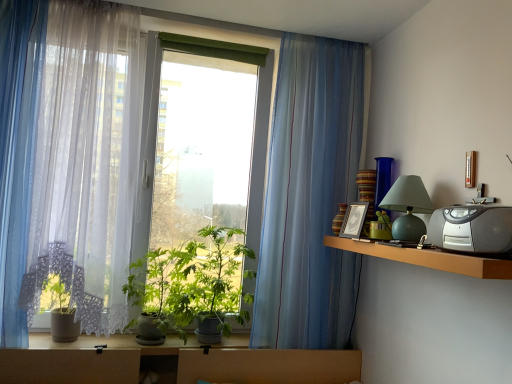
Question: From a real-world perspective, is translucent fabric curtain at left, which is the 3th curtain from right to left, above or below translucent blue curtain at center, arranged as the 3th curtain when viewed from the left?

Choices:
 (A) above
 (B) below

Answer: (A)

Question: Considering the positions of translucent fabric curtain at left, which is the 3th curtain from right to left, and translucent blue curtain at center, acting as the first curtain starting from the right, in the image, is translucent fabric curtain at left, which is the 3th curtain from right to left, wider or thinner than translucent blue curtain at center, acting as the first curtain starting from the right,?

Choices:
 (A) thin
 (B) wide

Answer: (B)

Question: Which of these objects is positioned farthest from the silver plastic radio at upper right?

Choices:
 (A) translucent white curtain at left, placed as the second curtain when sorted from right to left
 (B) translucent blue curtain at center, arranged as the 3th curtain when viewed from the left
 (C) translucent fabric curtain at left, which is the 1th curtain from left to right
 (D) brown wooden shelf at right
 (E) transparent fabric at left

Answer: (C)

Question: Considering the real-world distances, which object is closest to the silver plastic radio at upper right?

Choices:
 (A) brown wooden shelf at right
 (B) transparent fabric at left
 (C) translucent blue curtain at center, acting as the first curtain starting from the right
 (D) translucent fabric curtain at left, which is the 1th curtain from left to right
 (E) translucent white curtain at left, placed as the second curtain when sorted from right to left

Answer: (A)